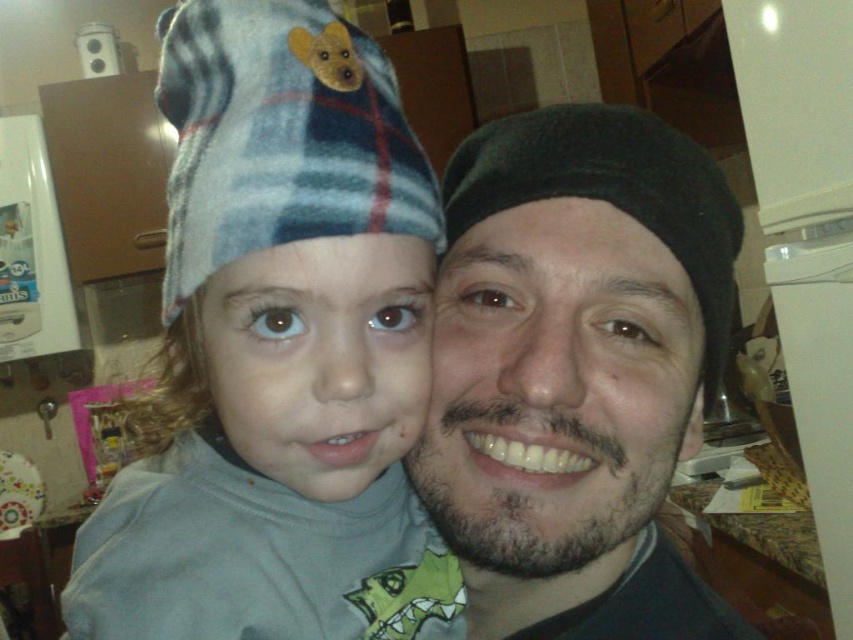
Question: Does fluffy fleece hat at upper left appear on the left side of black matte beret at center?

Choices:
 (A) yes
 (B) no

Answer: (A)

Question: Can you confirm if fluffy fleece hat at upper left is positioned to the left of plaid flannel hat at upper left?

Choices:
 (A) yes
 (B) no

Answer: (A)

Question: Which object is closer to the camera taking this photo?

Choices:
 (A) black matte beret at center
 (B) fluffy fleece hat at upper left
 (C) plaid flannel hat at upper left

Answer: (B)

Question: Which point is farther from the camera taking this photo?

Choices:
 (A) [393, 234]
 (B) [532, 436]

Answer: (B)

Question: Estimate the real-world distances between objects in this image. Which object is farther from the plaid flannel hat at upper left?

Choices:
 (A) black matte beret at center
 (B) fluffy fleece hat at upper left

Answer: (A)

Question: Does black matte beret at center have a larger size compared to plaid flannel hat at upper left?

Choices:
 (A) no
 (B) yes

Answer: (B)